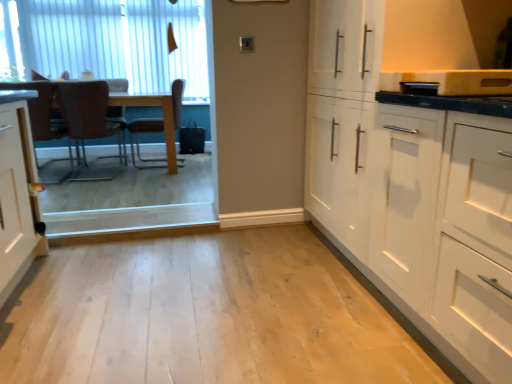
Question: From the image's perspective, is brown leather chair at center, placed as the 3th chair when sorted from left to right, on white vertical blinds at upper left?

Choices:
 (A) yes
 (B) no

Answer: (B)

Question: Is brown leather chair at center, placed as the 3th chair when sorted from left to right, at the right side of white vertical blinds at upper left?

Choices:
 (A) yes
 (B) no

Answer: (A)

Question: From a real-world perspective, is brown leather chair at center, placed as the 3th chair when sorted from left to right, positioned under white vertical blinds at upper left based on gravity?

Choices:
 (A) yes
 (B) no

Answer: (A)

Question: Is brown leather chair at center, the first chair viewed from the right, aimed at white vertical blinds at upper left?

Choices:
 (A) yes
 (B) no

Answer: (B)

Question: Is brown leather chair at center, placed as the 3th chair when sorted from left to right, positioned behind white vertical blinds at upper left?

Choices:
 (A) no
 (B) yes

Answer: (A)

Question: Is brown leather chair at center, the first chair viewed from the right, not near white vertical blinds at upper left?

Choices:
 (A) yes
 (B) no

Answer: (A)

Question: From the image's perspective, is brown leather chair at center, the first chair viewed from the right, under brown leather chair at left, which is counted as the 1th chair, starting from the left?

Choices:
 (A) no
 (B) yes

Answer: (A)

Question: From the image's perspective, is brown leather chair at center, placed as the 3th chair when sorted from left to right, on brown leather chair at left, which is counted as the 1th chair, starting from the left?

Choices:
 (A) no
 (B) yes

Answer: (B)

Question: Is brown leather chair at center, the first chair viewed from the right, oriented towards brown leather chair at left, which is counted as the 1th chair, starting from the left?

Choices:
 (A) no
 (B) yes

Answer: (A)

Question: From a real-world perspective, is brown leather chair at center, placed as the 3th chair when sorted from left to right, located higher than brown leather chair at left, which is counted as the 1th chair, starting from the left?

Choices:
 (A) no
 (B) yes

Answer: (B)

Question: Does brown leather chair at center, the first chair viewed from the right, have a greater height compared to brown leather chair at left, which is counted as the 1th chair, starting from the left?

Choices:
 (A) no
 (B) yes

Answer: (A)

Question: Does brown leather chair at center, the first chair viewed from the right, have a smaller size compared to brown leather chair at left, which is counted as the 1th chair, starting from the left?

Choices:
 (A) no
 (B) yes

Answer: (A)

Question: Does white vertical blinds at upper left have a greater height compared to light wood floor at center?

Choices:
 (A) no
 (B) yes

Answer: (B)